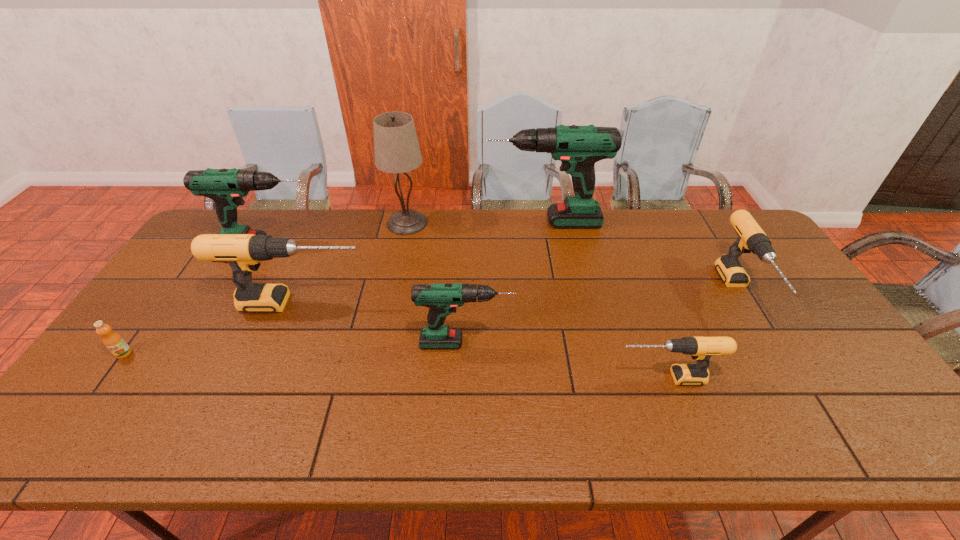
At what (x,y) coordinates should I click in order to perform the action: click on vacant area between the leftmost object and the shortest drill. Please return your answer as a coordinate pair (x, y). The image size is (960, 540). Looking at the image, I should click on (395, 366).

You are a GUI agent. You are given a task and a screenshot of the screen. Output one action in this format:
    pyautogui.click(x=<x>, y=<y>)
    Task: Click on the free space between the lampshade and the second farthest drill
    The image size is (960, 540).
    Given the screenshot: What is the action you would take?
    pyautogui.click(x=339, y=234)

This screenshot has width=960, height=540. In order to click on unoccupied position between the fifth nearest drill and the nearest green drill in this screenshot , I will do `click(368, 294)`.

Find the location of a particular element. free space between the shortest drill and the orange juice is located at coordinates (395, 366).

Locate which object is the fifth closest to the second smallest black drill. Please provide its 2D coordinates. Your answer should be formatted as a tuple, i.e. [(x, y)], where the tuple contains the x and y coordinates of a point satisfying the conditions above.

[(242, 252)]

Choose which object is the third nearest neighbor to the lampshade. Please provide its 2D coordinates. Your answer should be formatted as a tuple, i.e. [(x, y)], where the tuple contains the x and y coordinates of a point satisfying the conditions above.

[(242, 252)]

Locate an element on the screen. drill that can be found as the fourth closest to the farthest drill is located at coordinates (226, 187).

Identify which drill is located as the fourth nearest to the second biggest black drill. Please provide its 2D coordinates. Your answer should be formatted as a tuple, i.e. [(x, y)], where the tuple contains the x and y coordinates of a point satisfying the conditions above.

[(242, 252)]

You are a GUI agent. You are given a task and a screenshot of the screen. Output one action in this format:
    pyautogui.click(x=<x>, y=<y>)
    Task: Click on the green drill that is the nearest to the second farthest drill
    Image resolution: width=960 pixels, height=540 pixels.
    Given the screenshot: What is the action you would take?
    pyautogui.click(x=442, y=299)

What are the coordinates of `the closest green drill to the lampshade` in the screenshot? It's located at (226, 187).